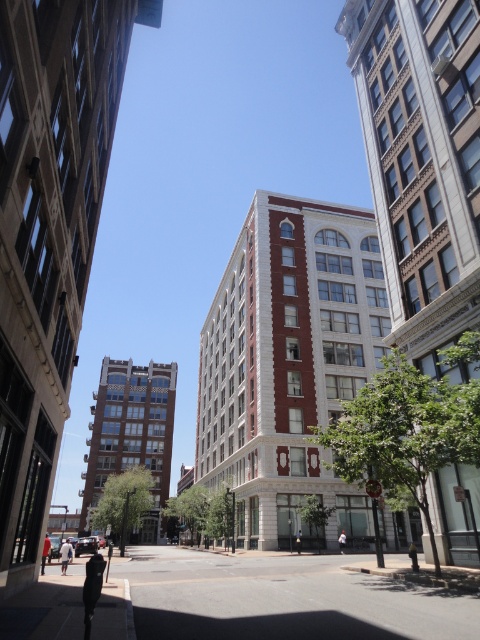
You are a delivery person trying to place a large box that is 1.2 meters wide between the metallic gold statue at center and the white cotton shirt at center. Can you fit the box in the space between them?

The metallic gold statue at center might be wider than the white cotton shirt at center, so the space between them may be sufficient to fit the 1.2 meter wide box. However, since the exact width difference isn not specified, it is uncertain. Please measure the actual space before placing the box.

You are standing in the city looking at the scene. There are two points marked in the image, point 1 at coordinate point (47, 540) and point 2 at coordinate point (412, 545). Which point is closer to you?

Point (47, 540) is closer to the camera than point (412, 545).

You are standing on a sidewalk in the city and see the dark blue jeans at lower left and the black fabric person at center. Which object is positioned higher from the ground?

The dark blue jeans at lower left is above the black fabric person at center, so it is positioned higher from the ground.